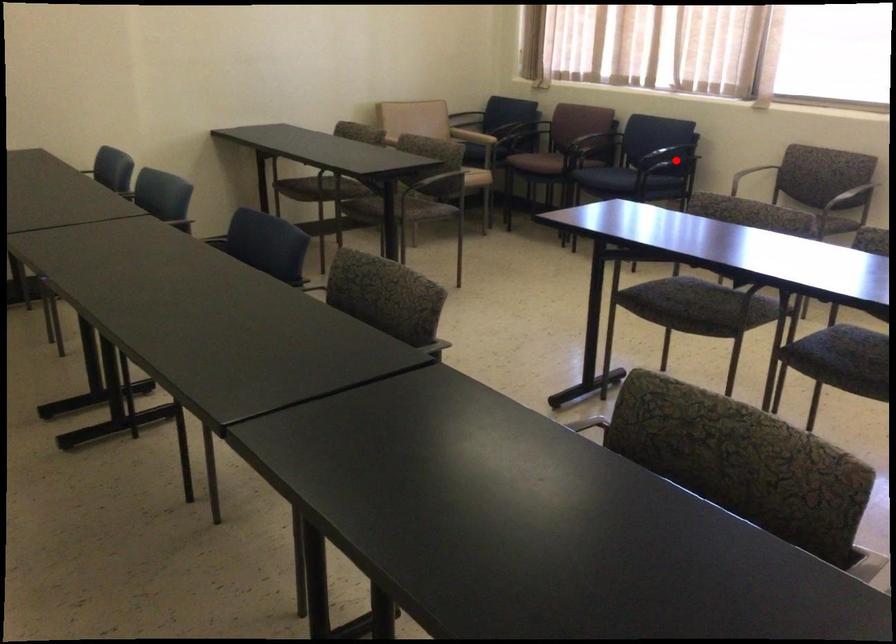
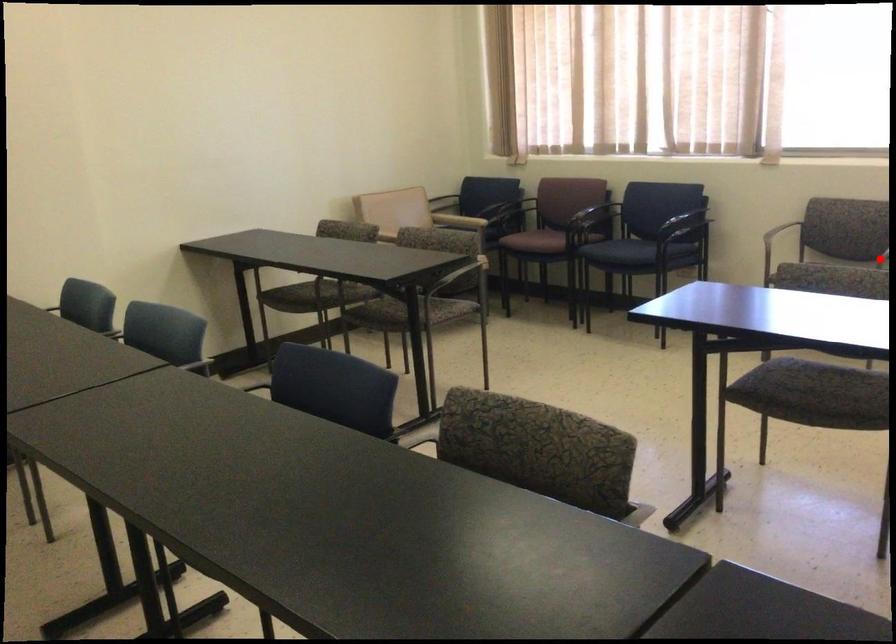
I am providing you with two images of the same scene from different viewpoints. A red point is marked on the first image and another point is marked on the second image. Is the marked point in image1 the same physical position as the marked point in image2?

No